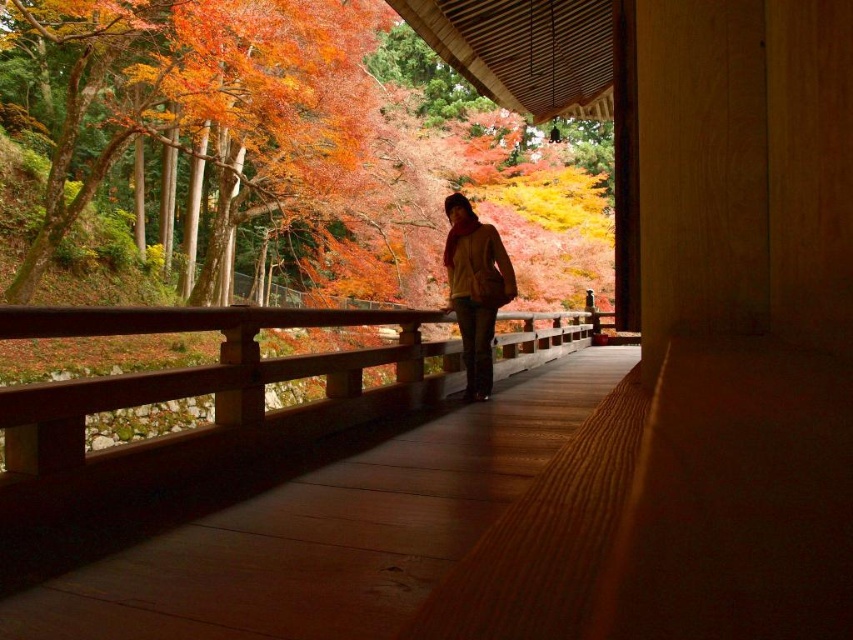
Consider the image. You are standing inside the wooden structure and looking out through the walkway. Which object is closer to you, the autumn leaves at upper left or the matte yellow sweater at center?

The autumn leaves at upper left are closer to you because they are further to the viewer than the matte yellow sweater at center.

You are standing inside the traditional wooden structure and want to walk towards the autumn foliage. There are two points marked on the walkway. Which point is closer to you, point (178,99) or point (486,298)?

Point (178,99) is closer to you because it is further to the viewer than point (486,298).

You are standing inside a traditional wooden structure and looking out. There is a point marked at coordinates (524,51). What is located at this point?

The point at coordinates (524,51) corresponds to autumn leaves at upper left.